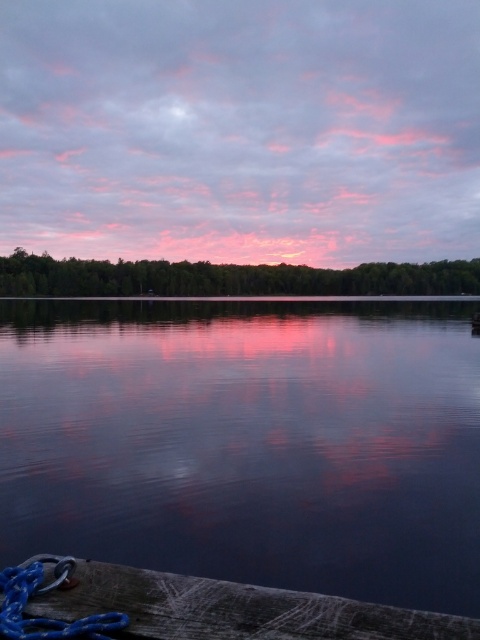
Question: Which object is the farthest from the blue rubber rope at lower left?

Choices:
 (A) blue wood at lower left
 (B) smooth water at center

Answer: (B)

Question: Is blue wood at lower left positioned behind blue rubber rope at lower left?

Choices:
 (A) no
 (B) yes

Answer: (B)

Question: In this image, where is smooth water at center located relative to blue wood at lower left?

Choices:
 (A) right
 (B) left

Answer: (A)

Question: Which of these objects is positioned closest to the blue wood at lower left?

Choices:
 (A) blue rubber rope at lower left
 (B) smooth water at center

Answer: (A)

Question: Observing the image, what is the correct spatial positioning of smooth water at center in reference to blue wood at lower left?

Choices:
 (A) left
 (B) right

Answer: (B)

Question: Which object appears farthest from the camera in this image?

Choices:
 (A) blue rubber rope at lower left
 (B) blue wood at lower left
 (C) smooth water at center

Answer: (C)